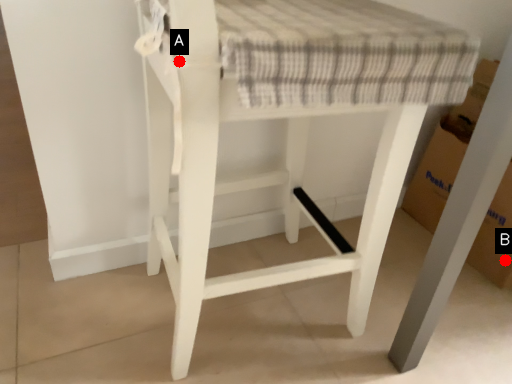
Question: Two points are circled on the image, labeled by A and B beside each circle. Which point is closer to the camera?

Choices:
 (A) A is closer
 (B) B is closer

Answer: (A)